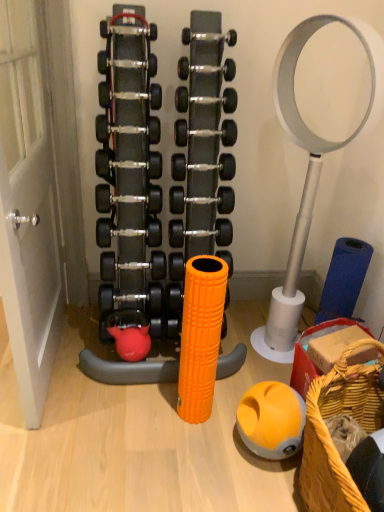
You are a GUI agent. You are given a task and a screenshot of the screen. Output one action in this format:
    pyautogui.click(x=<x>, y=<y>)
    Task: Click on the vacant area that is situated to the right of white matte door at left
    The height and width of the screenshot is (512, 384).
    Given the screenshot: What is the action you would take?
    pyautogui.click(x=147, y=409)